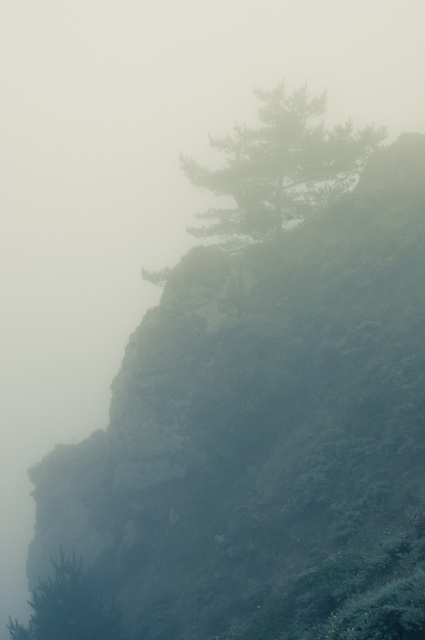
You are an environmental scientist studying the distribution of vegetation on a cliffside. You observe the green matte tree at upper center and the green matte tree at lower left. Which tree is located to the right of the other?

The green matte tree at upper center is positioned on the right side of green matte tree at lower left.

You are a hiker navigating a misty cliffside. You notice two points marked on your map at coordinates point (334, 173) and point (113, 608). Which point is closer to you when you are standing at the base of the cliff?

Point (113, 608) is closer to you because point (334, 173) is behind it according to the map.